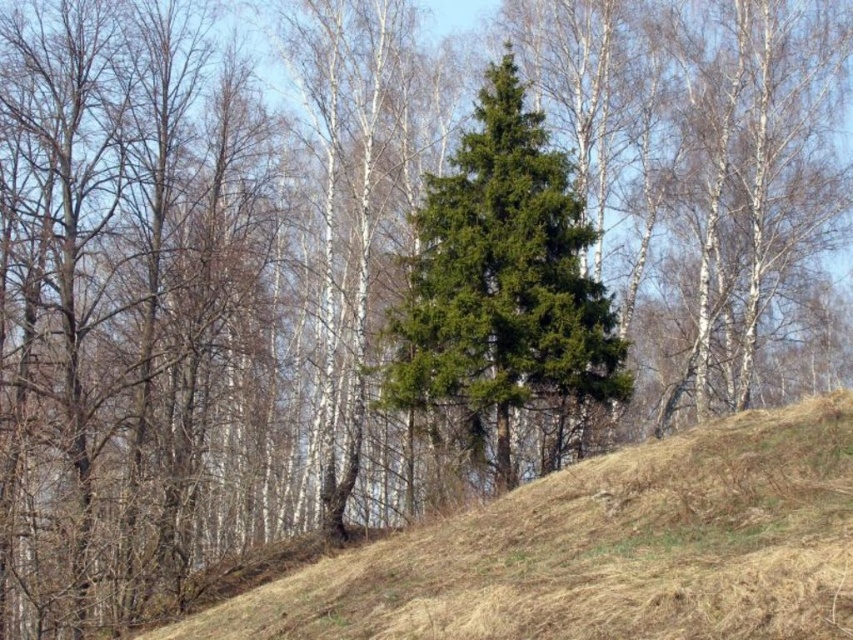
This screenshot has height=640, width=853. Identify the location of brown grassy hillside at lower left. (602, 550).

Between point (169, 628) and point (440, 225), which one is positioned behind?

The point (440, 225) is behind.

This screenshot has width=853, height=640. Identify the location of brown grassy hillside at lower left. (602, 550).